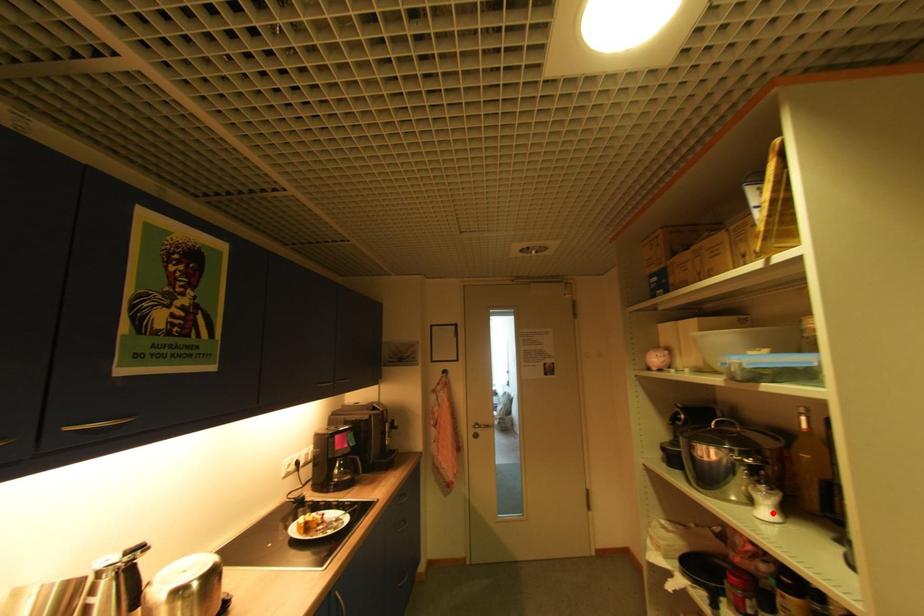
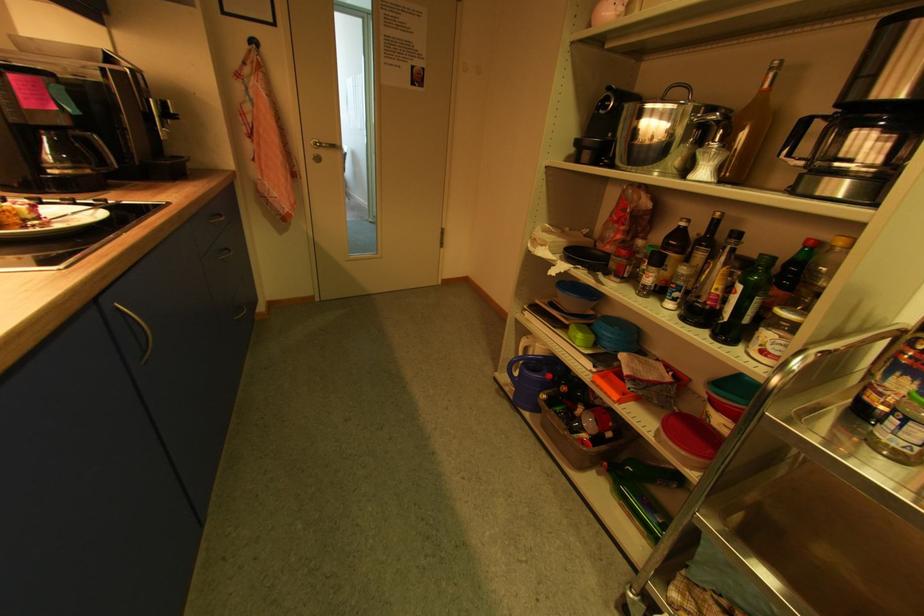
Find the pixel in the second image that matches the highlighted location in the first image.

(709, 175)